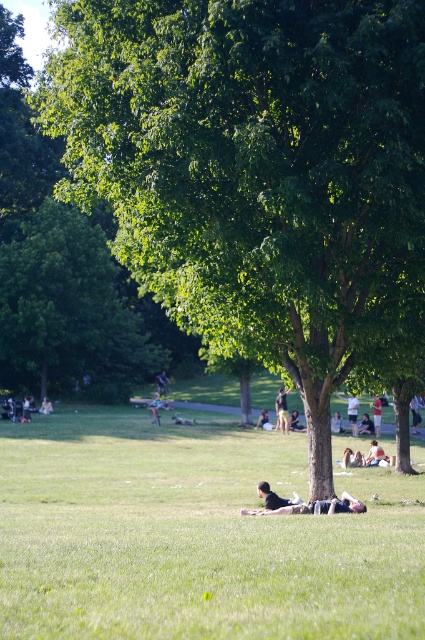
Question: Which of the following is the closest to the observer?

Choices:
 (A) light brown leather jacket at center
 (B) white cotton shirt at center
 (C) green grass at center

Answer: (C)

Question: Can you confirm if light brown leather jacket at center is smaller than dark brown leather jacket at center?

Choices:
 (A) yes
 (B) no

Answer: (B)

Question: Is light brown leather jacket at center bigger than white cotton shirt at center?

Choices:
 (A) no
 (B) yes

Answer: (B)

Question: Does green leafy tree at center appear on the right side of white cotton shirt at center?

Choices:
 (A) yes
 (B) no

Answer: (B)

Question: Which of the following is the farthest from the observer?

Choices:
 (A) light brown leather jacket at center
 (B) dark blue jeans at center
 (C) green fabric jacket at center

Answer: (C)

Question: Which object appears closest to the camera in this image?

Choices:
 (A) green leafy tree at center
 (B) dark brown leather jacket at center
 (C) white cotton shirt at center
 (D) light brown hair at center

Answer: (A)